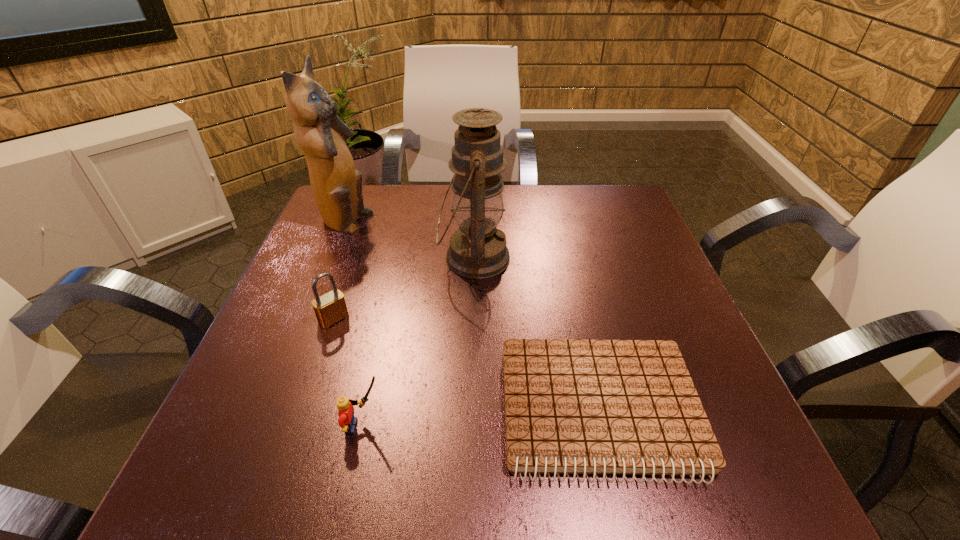
You are a GUI agent. You are given a task and a screenshot of the screen. Output one action in this format:
    pyautogui.click(x=<x>, y=<y>)
    Task: Click on the empty location between the third farthest object and the oil lamp
    This screenshot has height=540, width=960.
    Given the screenshot: What is the action you would take?
    pyautogui.click(x=404, y=288)

Where is `free space between the padlock and the oil lamp`? The width and height of the screenshot is (960, 540). free space between the padlock and the oil lamp is located at coordinates (404, 288).

Find the location of `free space between the shortest object and the cat`. free space between the shortest object and the cat is located at coordinates (472, 317).

Choose which object is the third nearest neighbor to the shortest object. Please provide its 2D coordinates. Your answer should be formatted as a tuple, i.e. [(x, y)], where the tuple contains the x and y coordinates of a point satisfying the conditions above.

[(329, 308)]

Where is `object that is the closest to the oil lamp`? This screenshot has width=960, height=540. object that is the closest to the oil lamp is located at coordinates (575, 407).

This screenshot has width=960, height=540. What are the coordinates of `vacant region that satisfies the following two spatial constraints: 1. on the face of the cat; 2. on the back side of the padlock` in the screenshot? It's located at (305, 319).

The height and width of the screenshot is (540, 960). What are the coordinates of `free space that satisfies the following two spatial constraints: 1. on the front side of the shortest object; 2. on the right side of the oil lamp` in the screenshot? It's located at (471, 410).

The width and height of the screenshot is (960, 540). In order to click on free space that satisfies the following two spatial constraints: 1. on the face of the cat; 2. on the back side of the notebook in this screenshot , I will do `click(267, 410)`.

Where is `free space in the image that satisfies the following two spatial constraints: 1. on the front side of the shortest object; 2. on the front-facing side of the third object from left to right`? This screenshot has height=540, width=960. free space in the image that satisfies the following two spatial constraints: 1. on the front side of the shortest object; 2. on the front-facing side of the third object from left to right is located at coordinates (604, 426).

What are the coordinates of `blank space that satisfies the following two spatial constraints: 1. on the face of the oil lamp; 2. on the left side of the cat` in the screenshot? It's located at (329, 258).